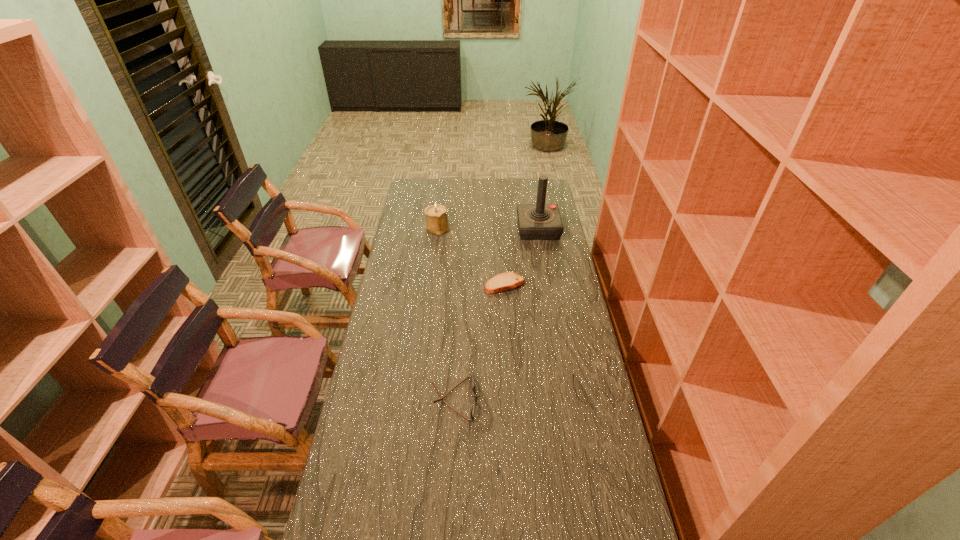
Identify the location of vacant space located on the front-facing side of the third tallest object. (564, 399).

You are a GUI agent. You are given a task and a screenshot of the screen. Output one action in this format:
    pyautogui.click(x=<x>, y=<y>)
    Task: Click on the free space located on the left of the second nearest object
    The width and height of the screenshot is (960, 540).
    Given the screenshot: What is the action you would take?
    pyautogui.click(x=469, y=285)

At what (x,y) coordinates should I click in order to perform the action: click on object that is at the left edge. Please return your answer as a coordinate pair (x, y). The height and width of the screenshot is (540, 960). Looking at the image, I should click on coord(436,215).

Find the location of `object present at the right edge`. object present at the right edge is located at coordinates (540, 221).

In order to click on vacant space at the far edge of the desktop in this screenshot , I will do coord(458,191).

This screenshot has width=960, height=540. Find the location of `free point at the left edge`. free point at the left edge is located at coordinates (393, 252).

Find the location of `vacant region at the right edge of the desktop`. vacant region at the right edge of the desktop is located at coordinates (569, 260).

This screenshot has height=540, width=960. I want to click on vacant space that's between the tallest object and the shortest object, so click(x=521, y=256).

This screenshot has width=960, height=540. In order to click on empty location between the shortest object and the spectacles in this screenshot , I will do `click(479, 341)`.

This screenshot has height=540, width=960. I want to click on free spot between the second tallest object and the joystick, so click(488, 228).